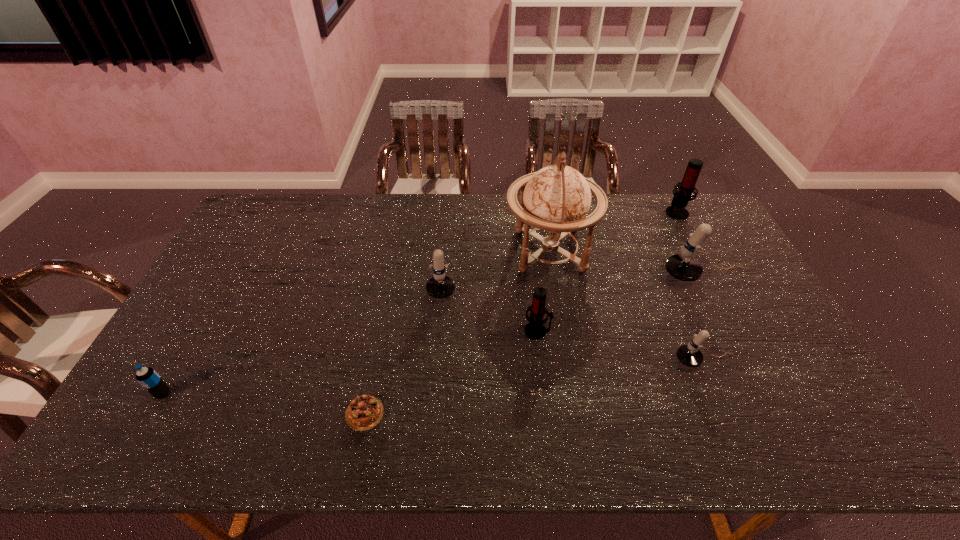
Find the location of a particular element. This screenshot has width=960, height=540. free space located 0.100m on the right of the nearest microphone is located at coordinates (773, 360).

At what (x,y) coordinates should I click in order to perform the action: click on vacant space located 0.070m on the back of the soda bottle. Please return your answer as a coordinate pair (x, y). This screenshot has height=540, width=960. Looking at the image, I should click on (180, 364).

Where is `free location located 0.210m on the back of the chocolate cake`? This screenshot has width=960, height=540. free location located 0.210m on the back of the chocolate cake is located at coordinates (381, 329).

You are a GUI agent. You are given a task and a screenshot of the screen. Output one action in this format:
    pyautogui.click(x=<x>, y=<y>)
    Task: Click on the globe that is positioned at the far edge
    The height and width of the screenshot is (540, 960).
    Given the screenshot: What is the action you would take?
    pyautogui.click(x=556, y=199)

Identify the location of microphone located in the far edge section of the desktop. (677, 210).

Find the location of a particular element. The height and width of the screenshot is (540, 960). object that is at the near edge is located at coordinates (364, 412).

Image resolution: width=960 pixels, height=540 pixels. In order to click on object at the left edge in this screenshot , I will do `click(147, 377)`.

Where is `object located at the far right corner`? This screenshot has height=540, width=960. object located at the far right corner is located at coordinates (677, 210).

Find the location of a particular element. vacant space at the far edge is located at coordinates (454, 207).

I want to click on free space at the near edge, so click(353, 436).